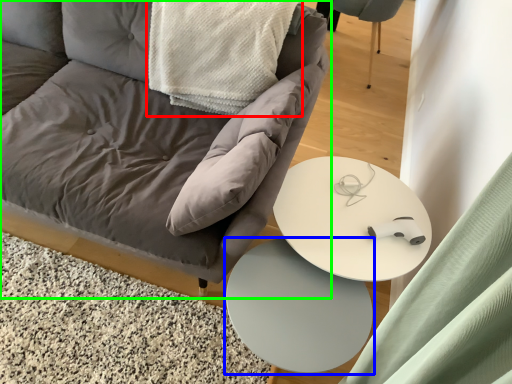
Question: Which is nearer to the material (highlighted by a red box)? table (highlighted by a blue box) or chair (highlighted by a green box).

Choices:
 (A) table
 (B) chair

Answer: (B)